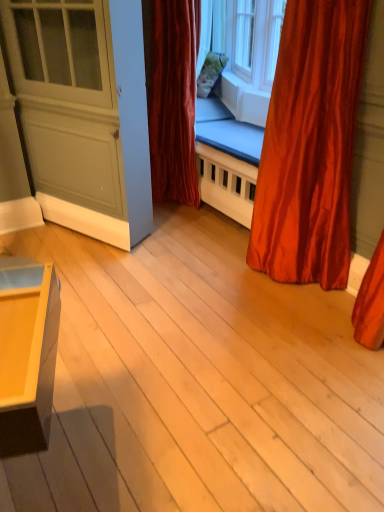
The width and height of the screenshot is (384, 512). In order to click on vacant space in front of matte gray screen door at left in this screenshot , I will do `click(99, 268)`.